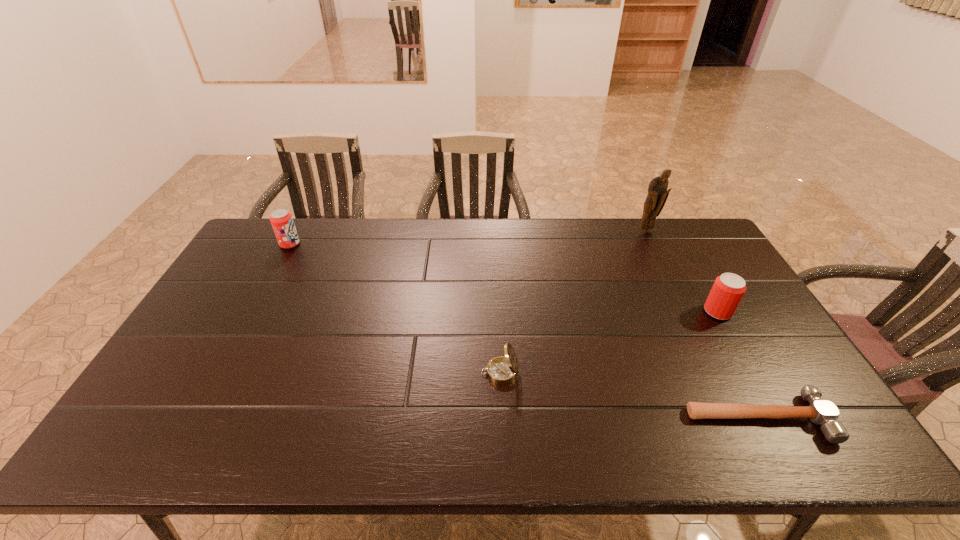
The height and width of the screenshot is (540, 960). I want to click on vacant area that lies between the leftmost object and the shortest object, so click(524, 331).

Find the location of a particular element. vacant area that lies between the farthest object and the nearest object is located at coordinates coord(703,325).

Identify the location of free space between the tallest object and the leftmost object. The height and width of the screenshot is (540, 960). (468, 238).

This screenshot has width=960, height=540. I want to click on vacant space that's between the beer can and the second shortest object, so click(609, 342).

Identify the location of free space between the farthest object and the hammer. (703, 325).

At what (x,y) coordinates should I click in order to perform the action: click on free point between the third farthest object and the second farthest object. Please return your answer as a coordinate pair (x, y). Looking at the image, I should click on (504, 278).

Where is `vacant region between the farthest object and the soda can`? This screenshot has width=960, height=540. vacant region between the farthest object and the soda can is located at coordinates (468, 238).

This screenshot has width=960, height=540. I want to click on vacant space in between the hammer and the second nearest object, so click(x=629, y=395).

Identify the location of vacant area that lies between the leftmost object and the tallest object. The height and width of the screenshot is (540, 960). (468, 238).

This screenshot has width=960, height=540. I want to click on object that ranks as the second closest to the third farthest object, so click(657, 195).